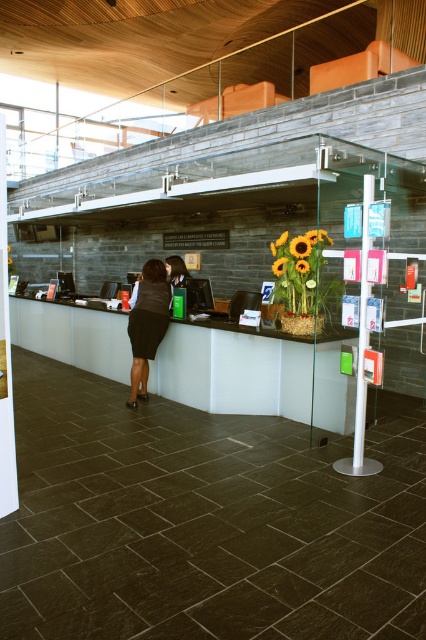
You are a visitor entering the reception area and want to approach the white glossy information desk at center to ask for directions. However, there is a black fabric skirt at center in your path. Can you walk directly to the desk without moving around the skirt?

The black fabric skirt at center is behind the white glossy information desk at center, so you can walk directly to the desk without needing to move around the skirt since the skirt is positioned behind the desk.

You are standing at the entrance of the reception area. The entrance is located at point 0.0 on the coordinate system. You need to reach the white glossy information desk at center. What is the shortest distance you need to walk to reach it?

The white glossy information desk at center is located at point 0.583, so the shortest distance you need to walk is 0.583 units.